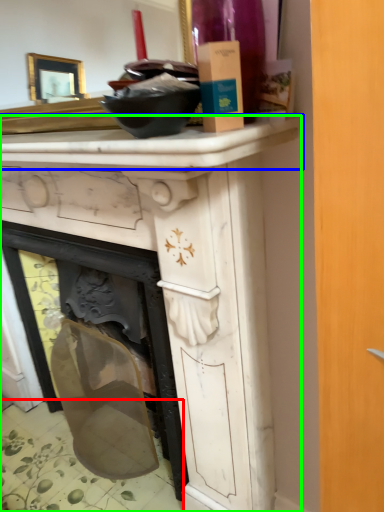
Question: Estimate the real-world distances between objects in this image. Which object is closer to tile (highlighted by a red box), counter top (highlighted by a blue box) or vanity (highlighted by a green box)?

Choices:
 (A) counter top
 (B) vanity

Answer: (B)